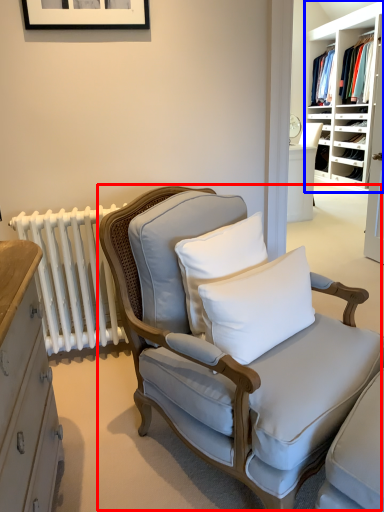
Question: Which object is closer to the camera taking this photo, chair (highlighted by a red box) or shelf (highlighted by a blue box)?

Choices:
 (A) chair
 (B) shelf

Answer: (A)